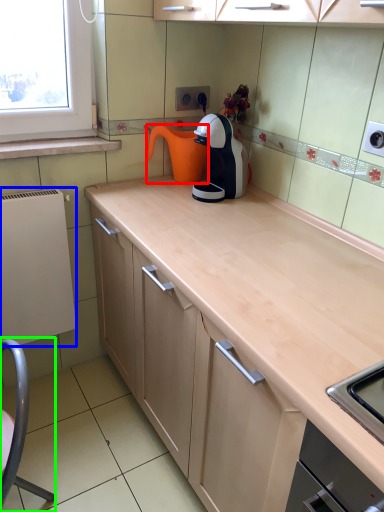
Question: Considering the real-world distances, which object is closest to coffeepot (highlighted by a red box)? appliance (highlighted by a blue box) or swivel chair (highlighted by a green box).

Choices:
 (A) appliance
 (B) swivel chair

Answer: (A)